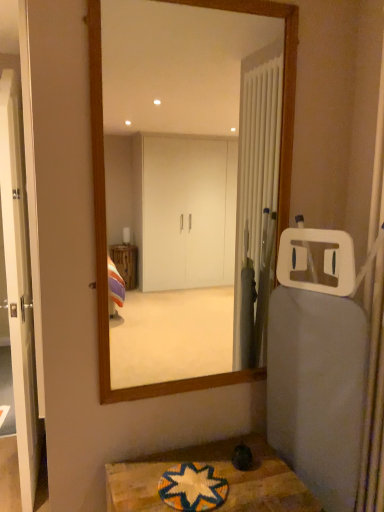
Where is `vacant space underneath multicolored woven mat at lower center (from a real-world perspective)`? The width and height of the screenshot is (384, 512). vacant space underneath multicolored woven mat at lower center (from a real-world perspective) is located at coordinates (182, 500).